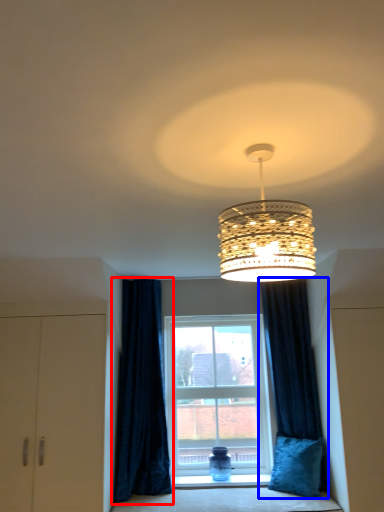
Question: Which of the following is the farthest to the observer, curtain (highlighted by a red box) or curtain (highlighted by a blue box)?

Choices:
 (A) curtain
 (B) curtain

Answer: (B)